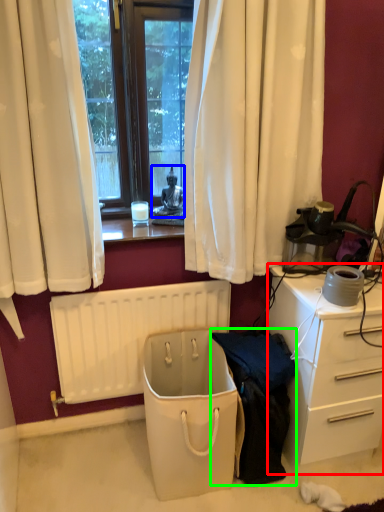
Question: Which object is positioned farthest from desk (highlighted by a red box)? Select from person (highlighted by a blue box) and clothing (highlighted by a green box).

Choices:
 (A) person
 (B) clothing

Answer: (A)